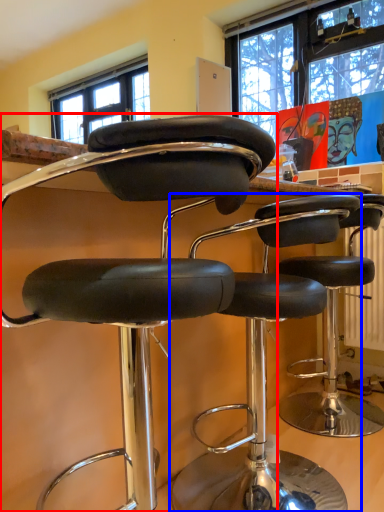
Question: Which of the following is the farthest to the observer, chair (highlighted by a red box) or chair (highlighted by a blue box)?

Choices:
 (A) chair
 (B) chair

Answer: (B)